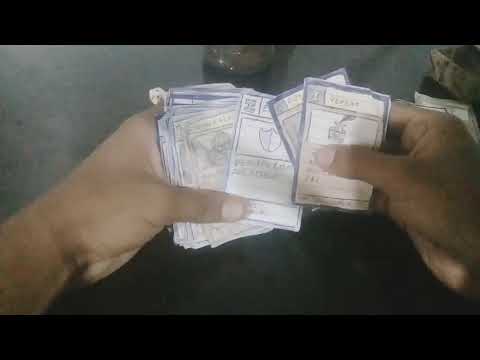
This screenshot has width=480, height=360. Identify the location of black table. tap(282, 265), tap(46, 100), tap(380, 56).